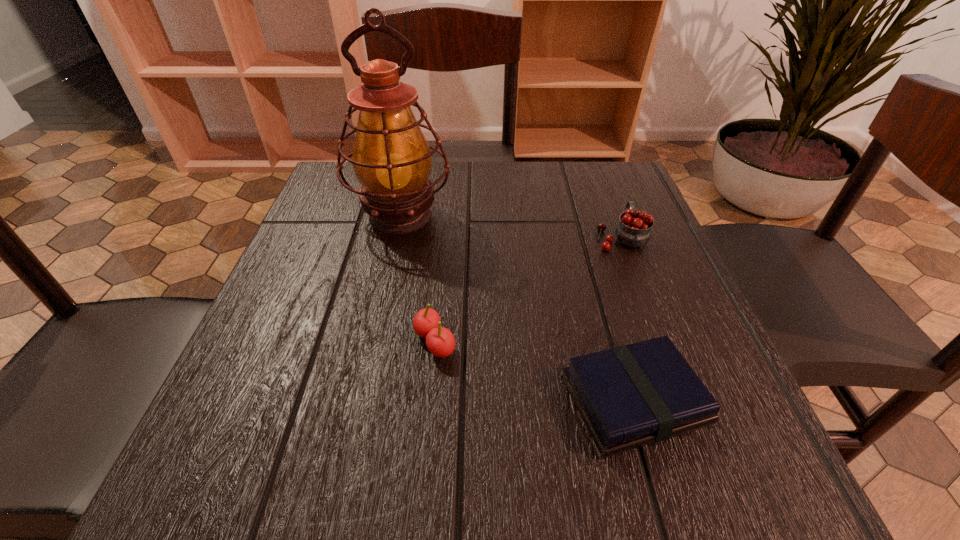
Locate an element on the screen. vacant area located on the right of the second shortest object is located at coordinates (531, 342).

Where is `free space located on the left of the book`? free space located on the left of the book is located at coordinates (405, 400).

Locate an element on the screen. Image resolution: width=960 pixels, height=540 pixels. object that is positioned at the far edge is located at coordinates 391,158.

Locate an element on the screen. object situated at the near edge is located at coordinates (629, 396).

Where is `object that is at the left edge`? The width and height of the screenshot is (960, 540). object that is at the left edge is located at coordinates (391, 158).

I want to click on cherry located at the right edge, so click(634, 229).

Where is `book that is at the right edge`? This screenshot has height=540, width=960. book that is at the right edge is located at coordinates (629, 396).

I want to click on object that is positioned at the far left corner, so click(391, 158).

The height and width of the screenshot is (540, 960). Identify the location of object that is positioned at the near right corner. (629, 396).

The image size is (960, 540). I want to click on vacant space at the far edge of the desktop, so click(543, 163).